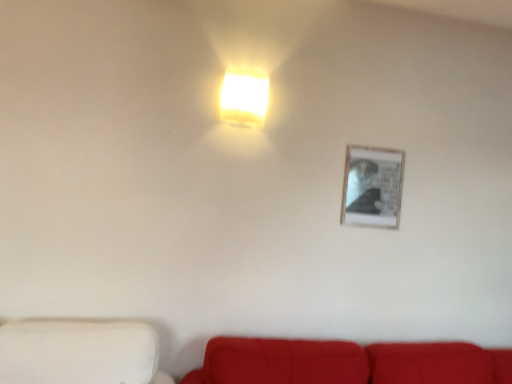
Question: From their relative heights in the image, would you say white matte wall at lower left is taller or shorter than velvet red couch at lower center?

Choices:
 (A) short
 (B) tall

Answer: (A)

Question: In terms of size, does white matte wall at lower left appear bigger or smaller than velvet red couch at lower center?

Choices:
 (A) small
 (B) big

Answer: (A)

Question: Considering the real-world distances, which object is farthest from the white matte wall at lower left?

Choices:
 (A) matte white square at upper center
 (B) velvet red couch at lower center

Answer: (A)

Question: Which object is positioned closest to the matte white square at upper center?

Choices:
 (A) velvet red couch at lower center
 (B) white matte wall at lower left

Answer: (B)